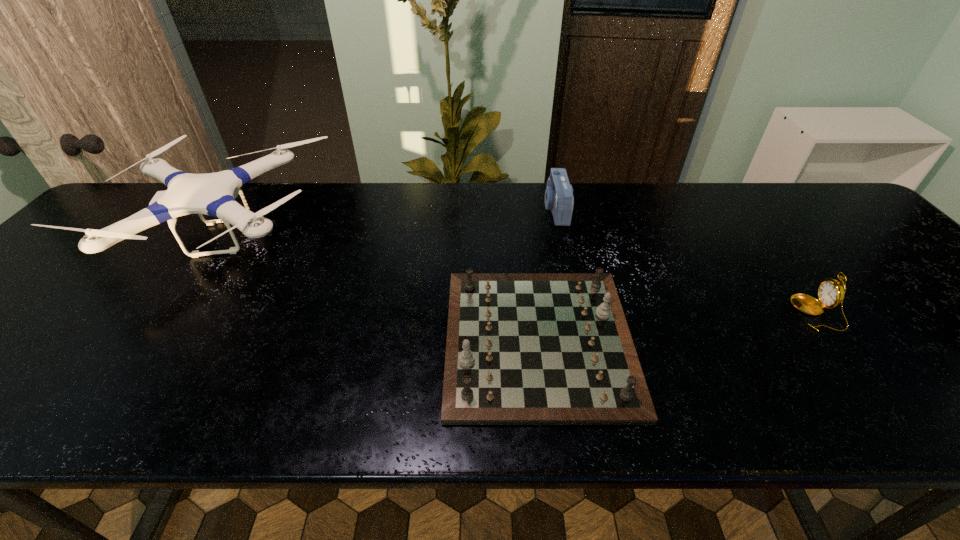
Locate an element on the screen. This screenshot has height=540, width=960. the leftmost object is located at coordinates (213, 194).

Image resolution: width=960 pixels, height=540 pixels. Find the location of `drone`. drone is located at coordinates (213, 194).

You are a GUI agent. You are given a task and a screenshot of the screen. Output one action in this format:
    pyautogui.click(x=<x>, y=<y>)
    Task: Click on the camera
    
    Given the screenshot: What is the action you would take?
    pyautogui.click(x=559, y=198)

This screenshot has width=960, height=540. Identify the location of the rightmost object. (831, 293).

Where is `the shortest object`? The height and width of the screenshot is (540, 960). the shortest object is located at coordinates (522, 348).

Find the location of `free space located on the front of the leftmost object`. free space located on the front of the leftmost object is located at coordinates (141, 353).

Locate an element on the screen. The height and width of the screenshot is (540, 960). vacant point located on the lens of the camera is located at coordinates (469, 209).

You are a GUI agent. You are given a task and a screenshot of the screen. Output one action in this format:
    pyautogui.click(x=<x>, y=<y>)
    Task: Click on the vacant position located on the lens of the camera
    This screenshot has height=540, width=960.
    Given the screenshot: What is the action you would take?
    pyautogui.click(x=460, y=209)

Locate an element on the screen. The image size is (960, 540). free point located 0.060m on the lens of the camera is located at coordinates [524, 209].

Locate an element on the screen. vacant space located on the face of the pocket watch is located at coordinates (734, 313).